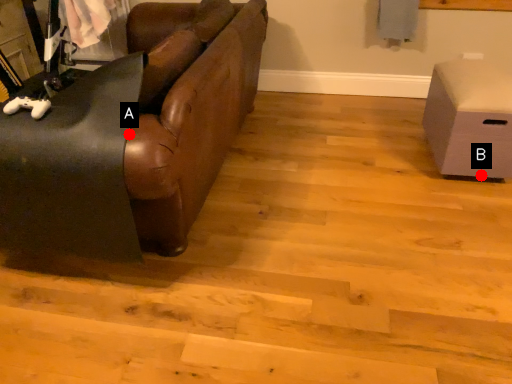
Question: Two points are circled on the image, labeled by A and B beside each circle. Which point is further to the camera?

Choices:
 (A) A is further
 (B) B is further

Answer: (B)